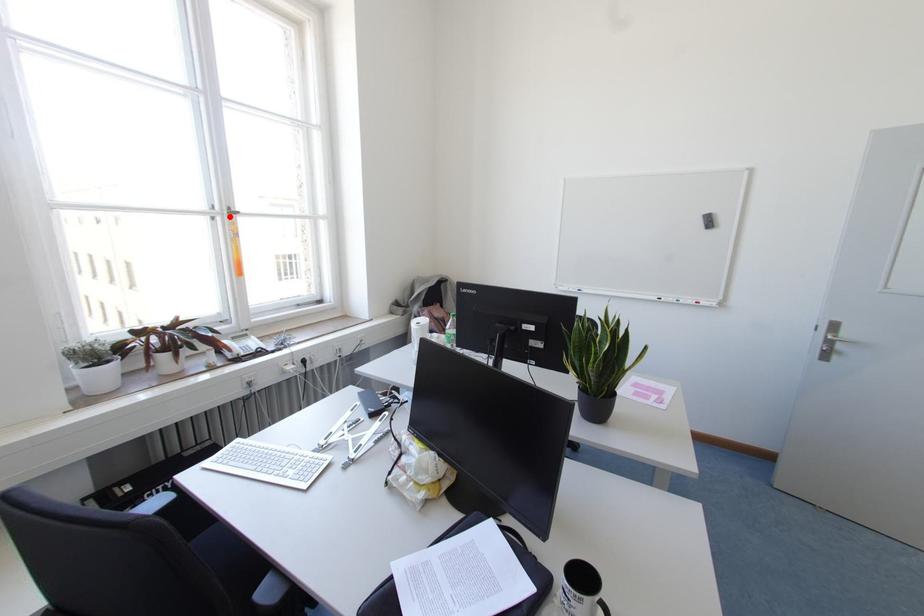
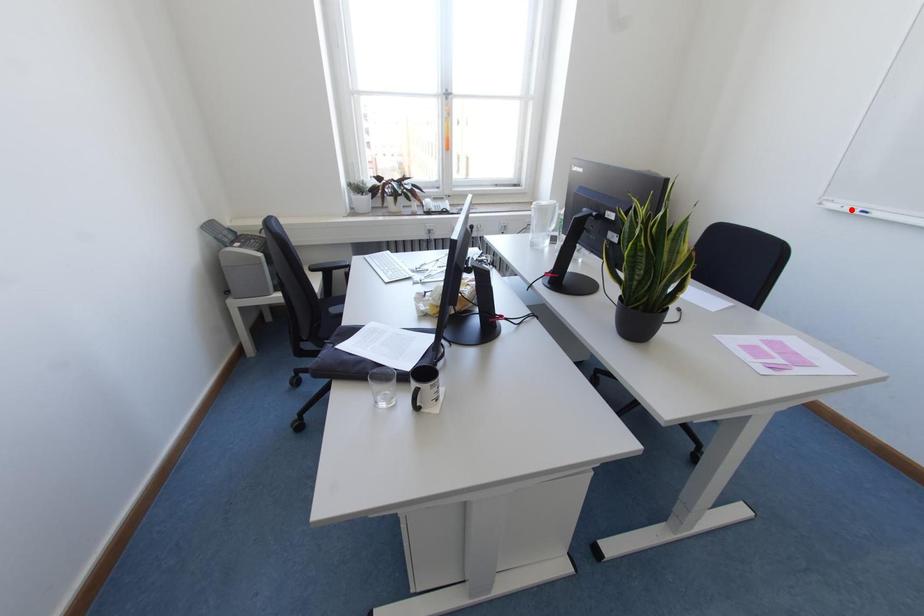
I am providing you with two images of the same scene from different viewpoints. A red point is marked on the first image and another point is marked on the second image. Do the highlighted points in image1 and image2 indicate the same real-world spot?

No